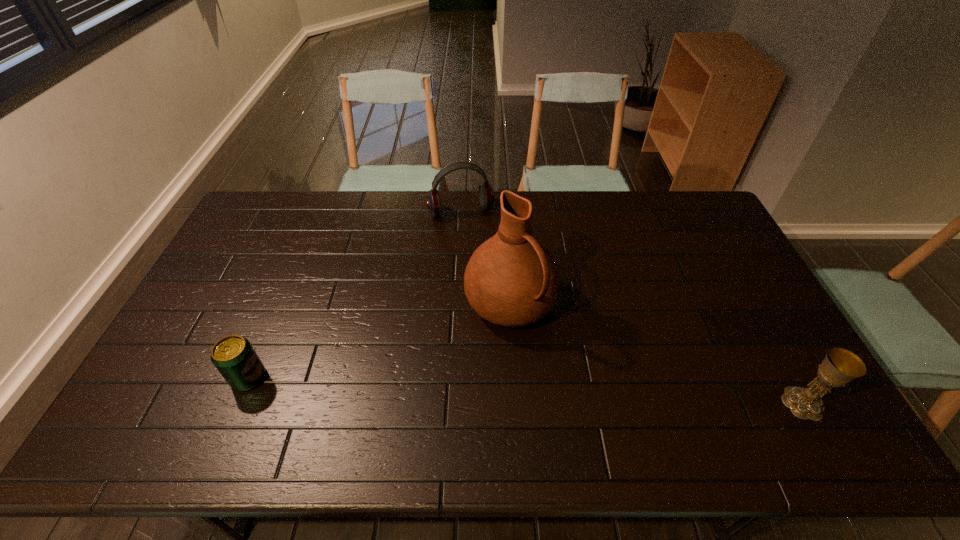
What are the coordinates of `vacant area located on the ear cups of the farthest object` in the screenshot? It's located at (472, 232).

This screenshot has width=960, height=540. In order to click on blank space located on the ear cups of the farthest object in this screenshot , I will do `click(473, 235)`.

This screenshot has width=960, height=540. What are the coordinates of `object present at the far edge` in the screenshot? It's located at (486, 195).

What are the coordinates of `beer can at the near edge` in the screenshot? It's located at (234, 357).

Locate an element on the screen. Image resolution: width=960 pixels, height=540 pixels. chalice that is at the near edge is located at coordinates (840, 366).

Locate an element on the screen. This screenshot has height=540, width=960. object located at the right edge is located at coordinates (840, 366).

The image size is (960, 540). What are the coordinates of `object that is positioned at the near right corner` in the screenshot? It's located at (840, 366).

At what (x,y) coordinates should I click in order to perform the action: click on free space at the far edge of the desktop. Please return your answer as a coordinate pair (x, y). Looking at the image, I should click on (420, 216).

This screenshot has height=540, width=960. In the image, there is a desktop. What are the coordinates of `vacant space at the near edge` in the screenshot? It's located at (611, 385).

Where is `vacant space at the left edge of the desktop`? vacant space at the left edge of the desktop is located at coordinates (194, 314).